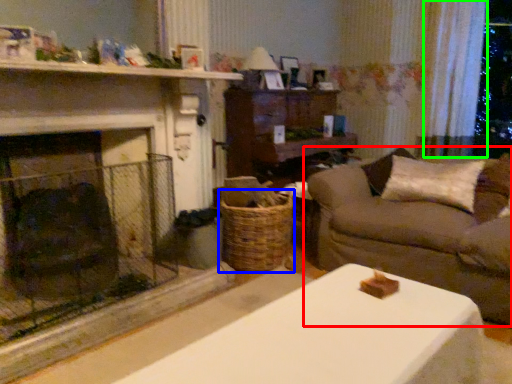
Question: Estimate the real-world distances between objects in this image. Which object is closer to studio couch (highlighted by a red box), basket (highlighted by a blue box) or curtain (highlighted by a green box)?

Choices:
 (A) basket
 (B) curtain

Answer: (A)